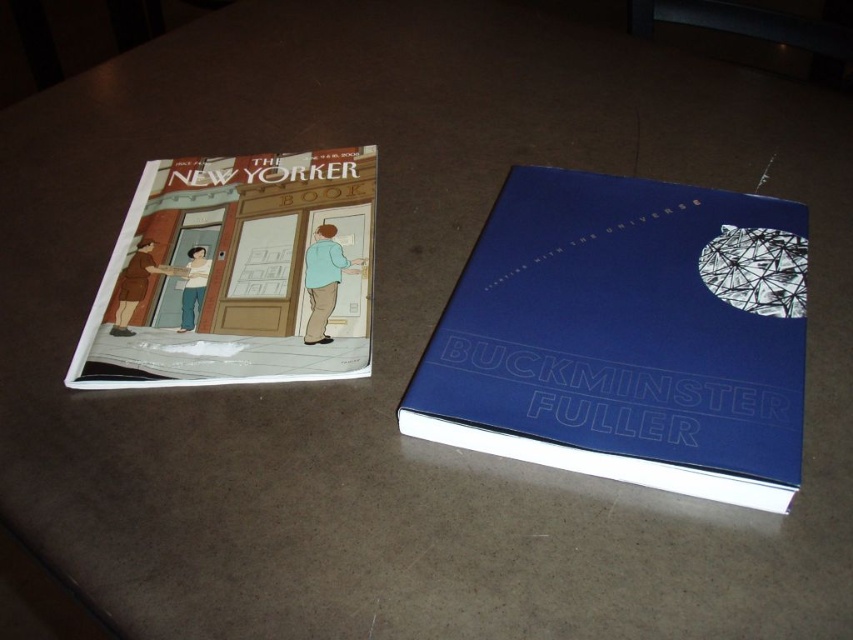
Question: Is blue hardcover book at center to the right of matte paper book at left from the viewer's perspective?

Choices:
 (A) no
 (B) yes

Answer: (B)

Question: Which point is farther to the camera?

Choices:
 (A) (265, 323)
 (B) (524, 358)

Answer: (A)

Question: Is blue hardcover book at center to the left of matte paper book at left from the viewer's perspective?

Choices:
 (A) no
 (B) yes

Answer: (A)

Question: Does blue hardcover book at center have a lesser width compared to matte paper book at left?

Choices:
 (A) no
 (B) yes

Answer: (A)

Question: Which point appears closest to the camera in this image?

Choices:
 (A) (233, 292)
 (B) (483, 294)

Answer: (B)